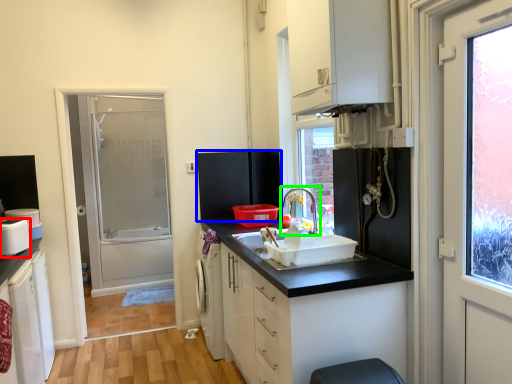
Question: Which object is positioned closest to appliance (highlighted by a red box)? Select from appliance (highlighted by a blue box) and tap (highlighted by a green box).

Choices:
 (A) appliance
 (B) tap

Answer: (A)